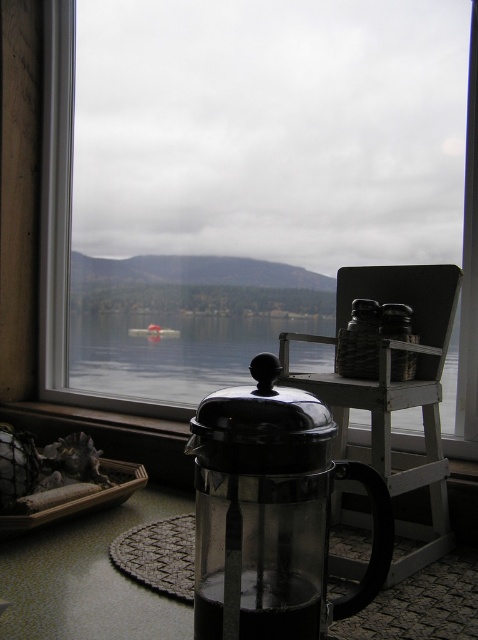
You are a guest in this room and want to place a small potted plant on the transparent glass french press at center so it can be seen from the wooden rocking chair at center. Is the height of the french press sufficient for this purpose?

The transparent glass french press at center is shorter than the wooden rocking chair at center. Since the plant would be placed on top of the french press, its height may not be enough to be seen from the wooden rocking chair at center unless the guest leans forward or stands up.

You are trying to decide whether to clean the transparent glass french press at center or the transparent glass window at center first. Which one is easier to reach from your current position?

The transparent glass french press at center is closer to the viewer than the transparent glass window at center, so it is easier to reach.